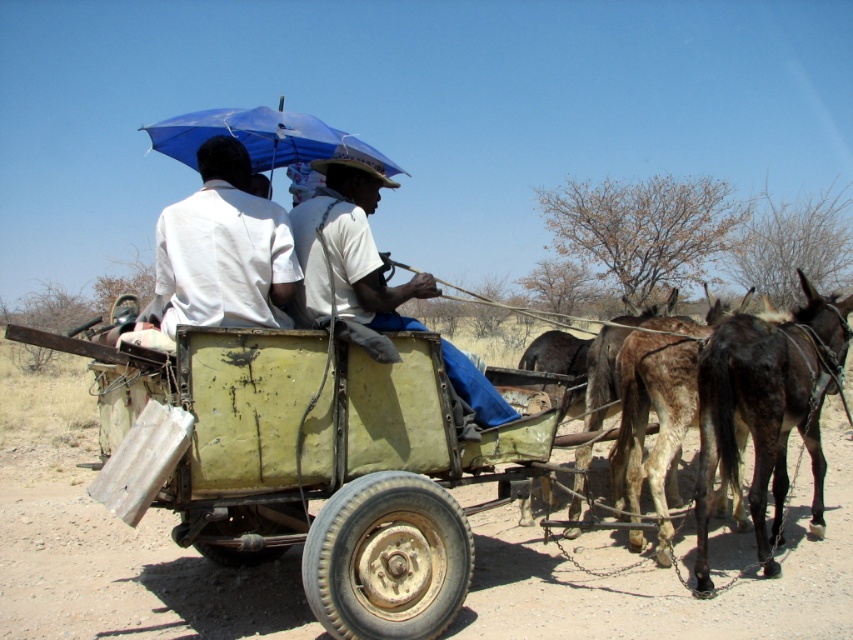
What do you see at coordinates (766, 410) in the screenshot? The width and height of the screenshot is (853, 640). I see `dark brown leather mule at right` at bounding box center [766, 410].

Is dark brown leather mule at right smaller than white cotton shirt at center?

Incorrect, dark brown leather mule at right is not smaller in size than white cotton shirt at center.

Who is more forward, (848, 336) or (317, 220)?

Positioned in front is point (317, 220).

You are a GUI agent. You are given a task and a screenshot of the screen. Output one action in this format:
    pyautogui.click(x=<x>, y=<y>)
    Task: Click on the dark brown leather mule at right
    This screenshot has height=640, width=853.
    Given the screenshot: What is the action you would take?
    pyautogui.click(x=766, y=410)

Is white matte shirt at upper center shorter than blue fabric umbrella at center?

Indeed, white matte shirt at upper center has a lesser height compared to blue fabric umbrella at center.

Is point (268, 269) more distant than point (260, 138)?

No, (268, 269) is closer to viewer.

At what (x,y) coordinates should I click in order to perform the action: click on white matte shirt at upper center. Please return your answer as a coordinate pair (x, y). The width and height of the screenshot is (853, 640). Looking at the image, I should click on (223, 250).

Is point (339, 186) positioned before point (260, 145)?

Yes, it is.

Is white cotton shirt at center wider than blue fabric umbrella at center?

In fact, white cotton shirt at center might be narrower than blue fabric umbrella at center.

Identify the location of white cotton shirt at center. (350, 248).

This screenshot has width=853, height=640. What are the coordinates of `white cotton shirt at center` in the screenshot? It's located at (350, 248).